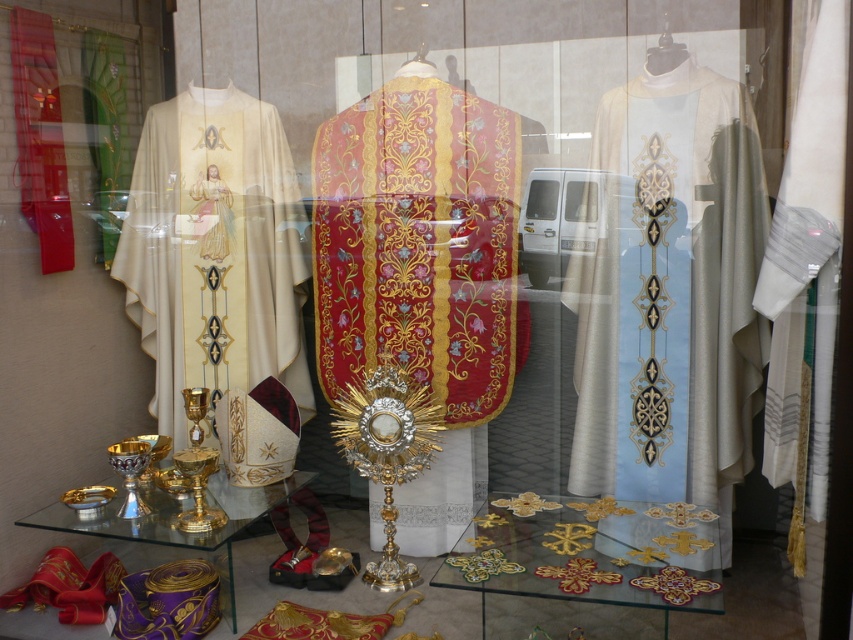
You are a delivery person who needs to place a large package on the transparent glass table at center without touching the rich red velvet robe at center. Is there enough space between them to safely place the package?

The distance between the rich red velvet robe at center and the transparent glass table at center is 57.98 centimeters. Therefore, there is sufficient space to place the large package on the transparent glass table at center without touching the rich red velvet robe at center.

You are a shop assistant arranging items in the shop window. You have a matte white robe at left and a gold embroidered robe at center. Which robe should you place on the lower shelf if you want to display the larger one there?

The matte white robe at left is bigger than the gold embroidered robe at center, so you should place the matte white robe at left on the lower shelf to display the larger one there.

You are a customer in the shop looking at the display through the window. You want to pick up the matte white robe at left and the gold embroidered robe at center. Which robe will you need to reach further into the display to get?

The gold embroidered robe at center is positioned above the matte white robe at left, so you will need to reach further into the display to get the gold embroidered robe at center.